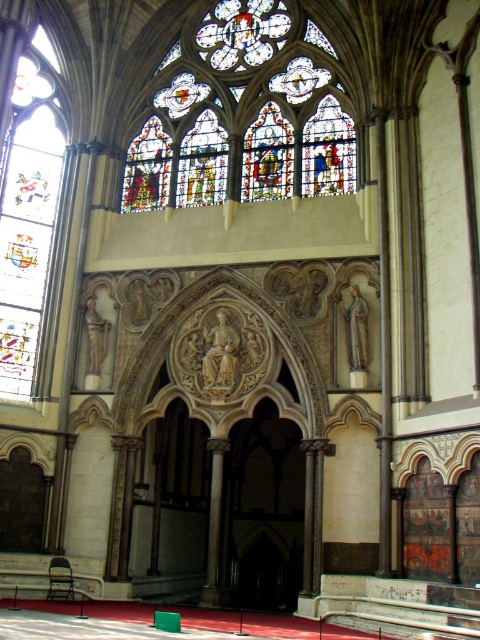
Is point (269, 116) farther from camera compared to point (2, 284)?

That is True.

Can you confirm if stained glass at upper center is positioned above stained glass window at left?

Yes, stained glass at upper center is above stained glass window at left.

What do you see at coordinates (243, 115) in the screenshot? The image size is (480, 640). I see `stained glass at upper center` at bounding box center [243, 115].

Locate an element on the screen. The image size is (480, 640). stained glass at upper center is located at coordinates (243, 115).